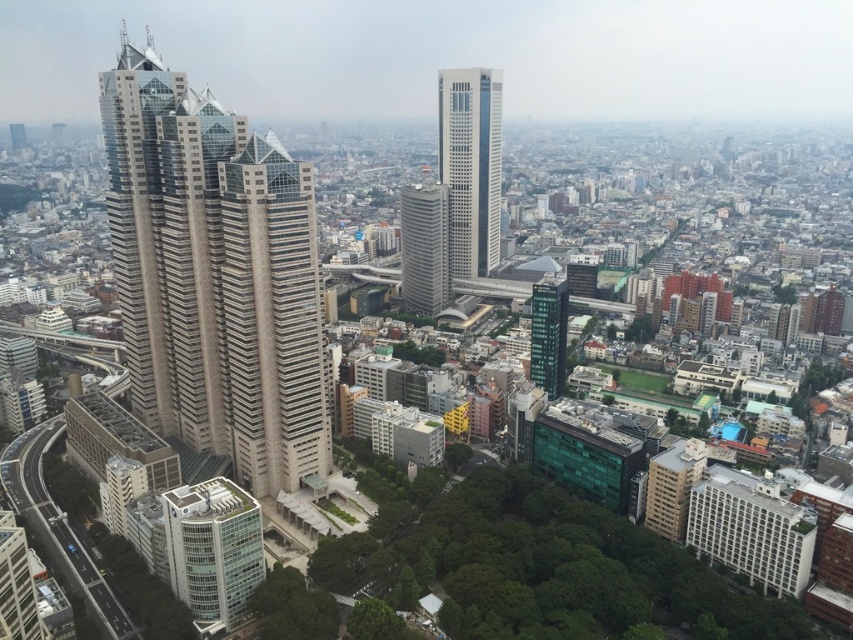
Question: In this image, where is beige glass skyscraper at center located relative to white glass skyscraper at center?

Choices:
 (A) above
 (B) below

Answer: (A)

Question: Is beige glass skyscraper at center above green glass building at center?

Choices:
 (A) no
 (B) yes

Answer: (B)

Question: Does white glossy building at center have a greater width compared to green glass building at center?

Choices:
 (A) yes
 (B) no

Answer: (B)

Question: Which object is the closest to the green glass building at center?

Choices:
 (A) white glossy building at center
 (B) white glass skyscraper at center

Answer: (B)

Question: Based on their relative distances, which object is nearer to the white glass skyscraper at center?

Choices:
 (A) beige glass skyscraper at center
 (B) green glass building at center

Answer: (B)

Question: Among these points, which one is farthest from the camera?

Choices:
 (A) (125, 278)
 (B) (474, 140)
 (C) (421, 236)

Answer: (B)